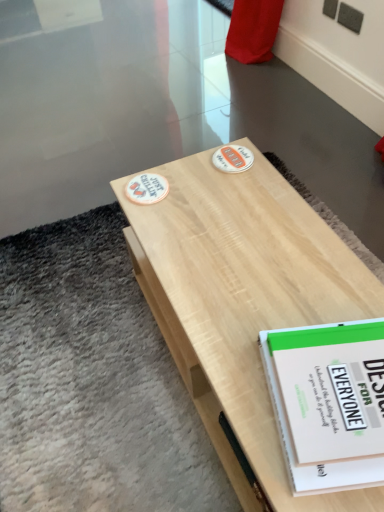
Question: Does white paper book at center have a lesser width compared to light wood table at center?

Choices:
 (A) no
 (B) yes

Answer: (B)

Question: Is white paper book at center far away from light wood table at center?

Choices:
 (A) yes
 (B) no

Answer: (B)

Question: Is light wood table at center a part of white paper book at center?

Choices:
 (A) yes
 (B) no

Answer: (B)

Question: Is the position of white paper book at center more distant than that of light wood table at center?

Choices:
 (A) yes
 (B) no

Answer: (A)

Question: From the image's perspective, is white paper book at center below light wood table at center?

Choices:
 (A) yes
 (B) no

Answer: (A)

Question: Would you say white paper book at center is outside light wood table at center?

Choices:
 (A) no
 (B) yes

Answer: (B)

Question: From the image's perspective, would you say light wood table at center is positioned over white paper book at center?

Choices:
 (A) yes
 (B) no

Answer: (A)

Question: Does light wood table at center appear on the right side of white paper book at center?

Choices:
 (A) yes
 (B) no

Answer: (B)

Question: Considering the relative sizes of light wood table at center and white paper book at center in the image provided, is light wood table at center smaller than white paper book at center?

Choices:
 (A) no
 (B) yes

Answer: (A)

Question: From a real-world perspective, is light wood table at center beneath white paper book at center?

Choices:
 (A) yes
 (B) no

Answer: (A)

Question: Is light wood table at center thinner than white paper book at center?

Choices:
 (A) no
 (B) yes

Answer: (A)

Question: Are light wood table at center and white paper book at center located far from each other?

Choices:
 (A) no
 (B) yes

Answer: (A)

Question: Is light wood table at center bigger or smaller than white paper book at center?

Choices:
 (A) big
 (B) small

Answer: (A)